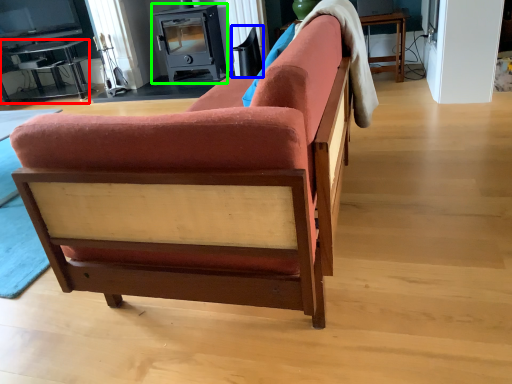
Question: Which object is the farthest from table (highlighted by a red box)? Choose among these: swivel chair (highlighted by a blue box) or appliance (highlighted by a green box).

Choices:
 (A) swivel chair
 (B) appliance

Answer: (A)